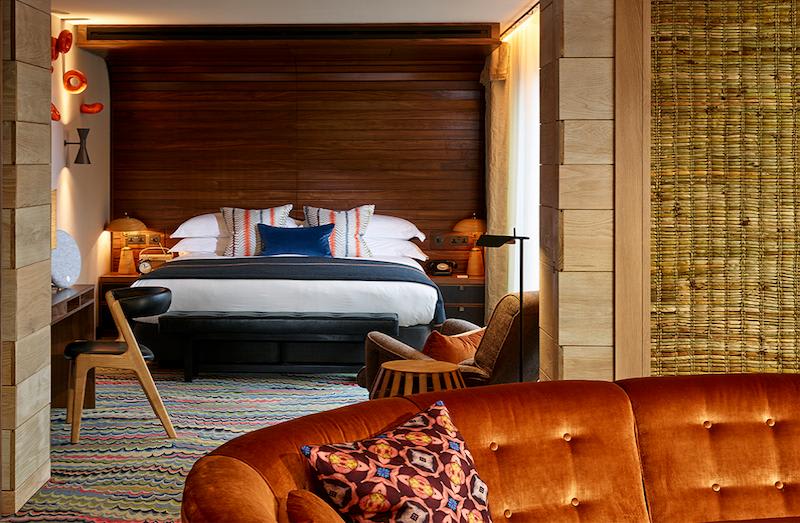
What are the coordinates of `blinds` in the screenshot? It's located at (720, 135).